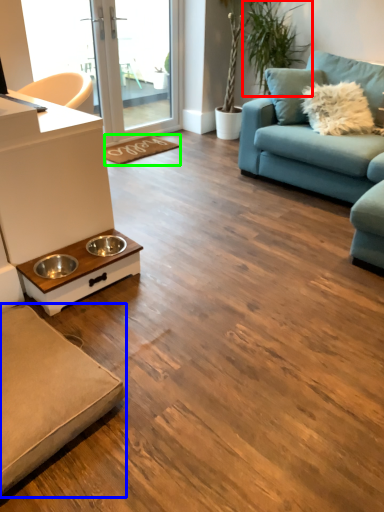
Question: Estimate the real-world distances between objects in this image. Which object is closer to plant (highlighted by a red box), studio couch (highlighted by a blue box) or doormat (highlighted by a green box)?

Choices:
 (A) studio couch
 (B) doormat

Answer: (B)